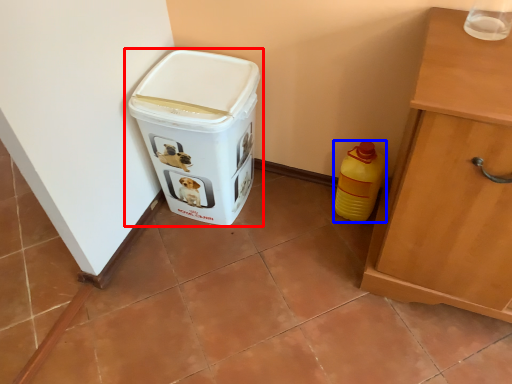
Question: Which object is further to the camera taking this photo, waste container (highlighted by a red box) or bottle (highlighted by a blue box)?

Choices:
 (A) waste container
 (B) bottle

Answer: (B)